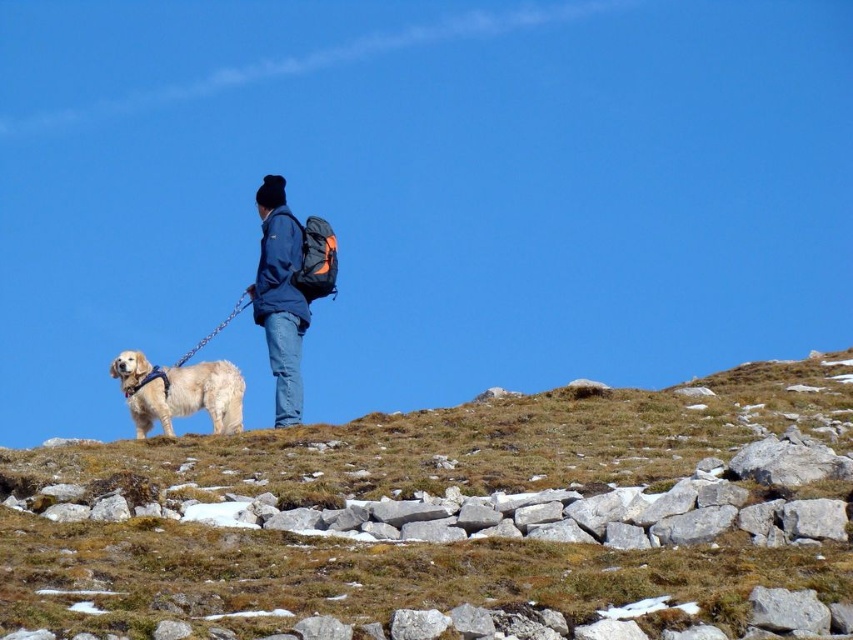
You are a hiker planning to set up a tent on the brown grassy hillside at lower center. The golden fur dog at left is tied to your backpack with a leash that is 50 feet long. Can the dog reach the hillside from its current position?

The distance between the brown grassy hillside at lower center and the golden fur dog at left is 74.30 feet. Since the leash is only 50 feet long, the dog cannot reach the hillside from its current position.

You are standing on the brown grassy hillside at lower center and want to walk towards the blue denim jacket at center. Is the jacket above or below your current position?

The blue denim jacket at center is above your current position because the brown grassy hillside at lower center is closer to the viewer, meaning the jacket is positioned higher up in the scene.

You are a photographer trying to capture a photo of the blue denim jacket at center and the golden fur dog at left. Based on their positions, which object is higher in the frame?

The blue denim jacket at center is located above the golden fur dog at left, so it is higher in the frame.